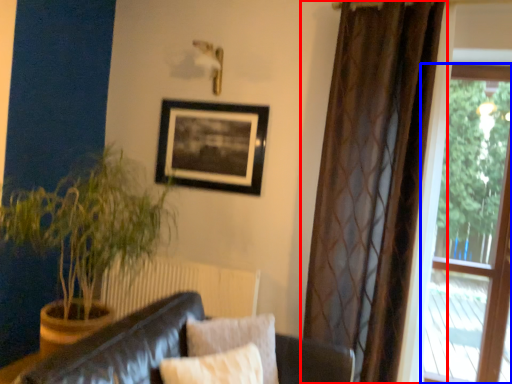
Question: Among these objects, which one is nearest to the camera, curtain (highlighted by a red box) or window (highlighted by a blue box)?

Choices:
 (A) curtain
 (B) window

Answer: (A)